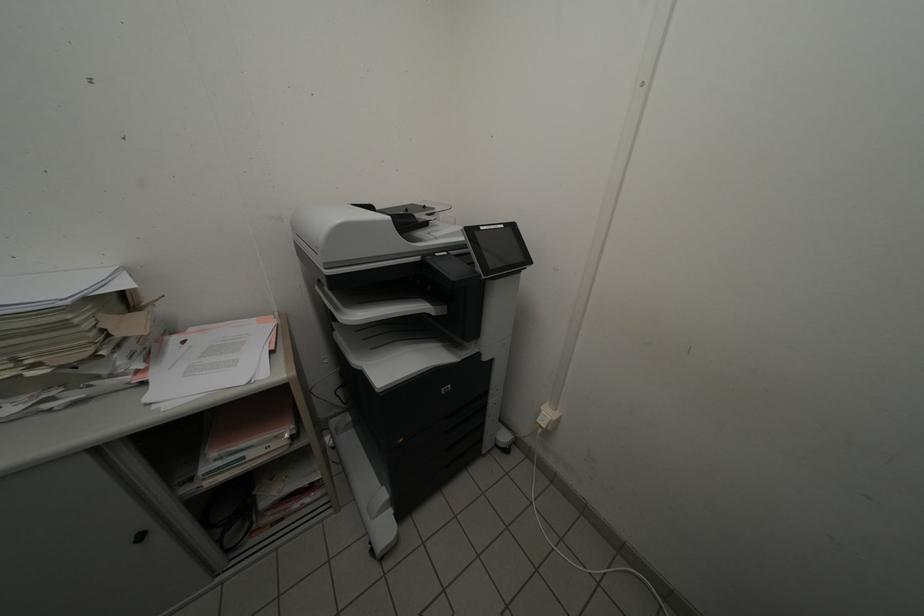
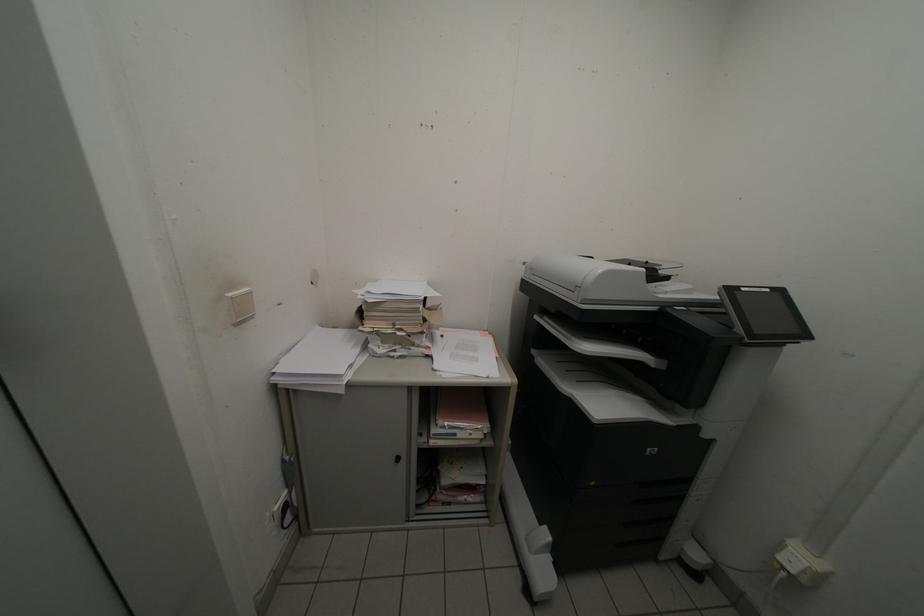
Question: The first image is from the beginning of the video and the second image is from the end. How did the camera likely rotate when shooting the video?

Choices:
 (A) Left
 (B) Right
 (C) Up
 (D) Down

Answer: (A)